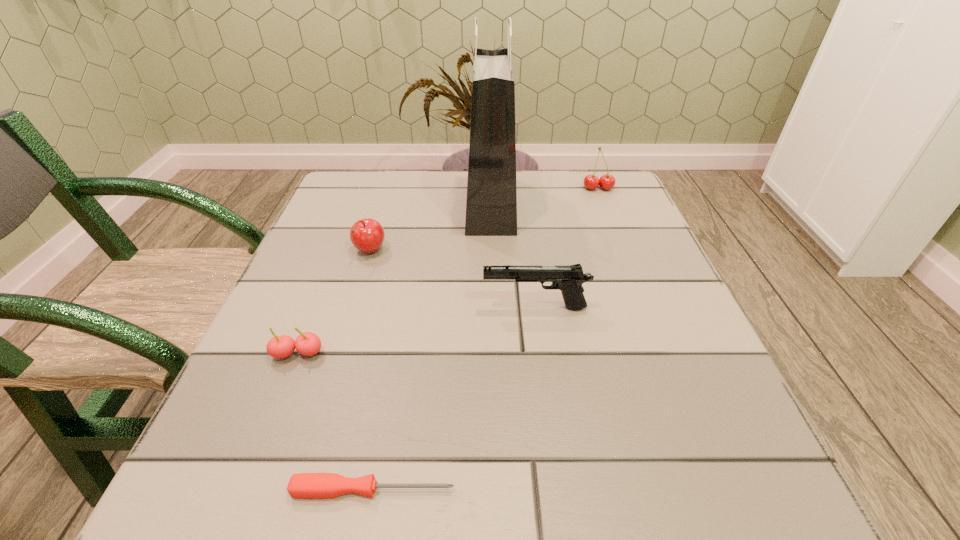
The width and height of the screenshot is (960, 540). I want to click on shopping bag situated at the far edge, so click(491, 203).

You are a GUI agent. You are given a task and a screenshot of the screen. Output one action in this format:
    pyautogui.click(x=<x>, y=<y>)
    Task: Click on the cherry situated at the far edge
    The image size is (960, 540).
    Given the screenshot: What is the action you would take?
    pyautogui.click(x=607, y=181)

Find the location of `object present at the near edge`. object present at the near edge is located at coordinates (301, 485).

Where is `screwdriver present at the left edge`? The height and width of the screenshot is (540, 960). screwdriver present at the left edge is located at coordinates (301, 485).

Locate an element on the screen. The width and height of the screenshot is (960, 540). object located at the right edge is located at coordinates (607, 181).

I want to click on object that is at the near left corner, so click(301, 485).

Locate an element on the screen. Image resolution: width=960 pixels, height=540 pixels. object that is at the far right corner is located at coordinates coord(607,181).

Where is `free space at the far edge of the desktop`? free space at the far edge of the desktop is located at coordinates (425, 197).

This screenshot has width=960, height=540. Find the location of `free space at the near edge of the desktop`. free space at the near edge of the desktop is located at coordinates (517, 465).

Where is `free location at the left edge of the desktop`? free location at the left edge of the desktop is located at coordinates (357, 305).